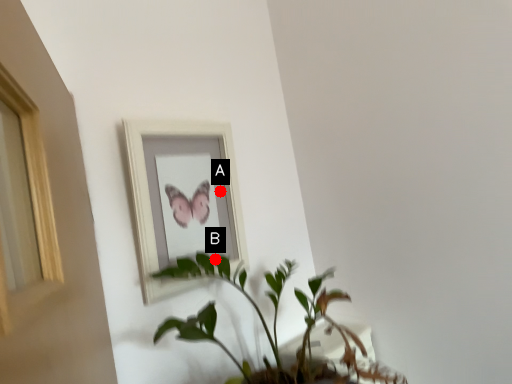
Question: Two points are circled on the image, labeled by A and B beside each circle. Which point is closer to the camera taking this photo?

Choices:
 (A) A is closer
 (B) B is closer

Answer: (B)